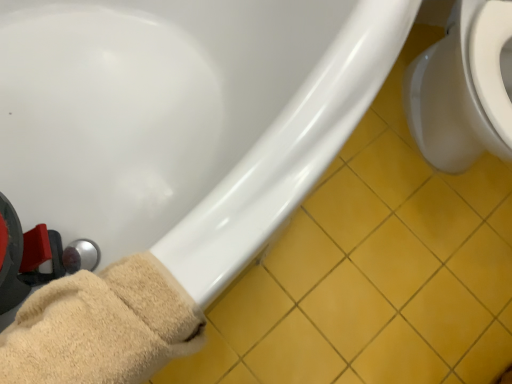
Question: Is beige fuzzy towel at lower left oriented away from white glossy bathtub at lower left?

Choices:
 (A) no
 (B) yes

Answer: (B)

Question: Is the depth of beige fuzzy towel at lower left greater than that of white glossy bathtub at lower left?

Choices:
 (A) no
 (B) yes

Answer: (B)

Question: Is beige fuzzy towel at lower left located outside white glossy bathtub at lower left?

Choices:
 (A) yes
 (B) no

Answer: (B)

Question: Does beige fuzzy towel at lower left have a greater height compared to white glossy bathtub at lower left?

Choices:
 (A) yes
 (B) no

Answer: (B)

Question: Can you confirm if beige fuzzy towel at lower left is positioned to the right of white glossy bathtub at lower left?

Choices:
 (A) no
 (B) yes

Answer: (A)

Question: Does beige fuzzy towel at lower left have a lesser height compared to white glossy bathtub at lower left?

Choices:
 (A) yes
 (B) no

Answer: (A)

Question: Is yellow tile at lower right bigger than white glossy bathtub at lower left?

Choices:
 (A) no
 (B) yes

Answer: (A)

Question: Is yellow tile at lower right to the right of white glossy bathtub at lower left from the viewer's perspective?

Choices:
 (A) yes
 (B) no

Answer: (A)

Question: Is yellow tile at lower right directly adjacent to white glossy bathtub at lower left?

Choices:
 (A) yes
 (B) no

Answer: (B)

Question: Does yellow tile at lower right appear on the left side of white glossy bathtub at lower left?

Choices:
 (A) yes
 (B) no

Answer: (B)

Question: Is yellow tile at lower right far from white glossy bathtub at lower left?

Choices:
 (A) yes
 (B) no

Answer: (B)

Question: Could you tell me if yellow tile at lower right is facing white glossy bathtub at lower left?

Choices:
 (A) yes
 (B) no

Answer: (B)

Question: Can you confirm if white glossy toilet at right is smaller than yellow tile at lower right?

Choices:
 (A) yes
 (B) no

Answer: (B)